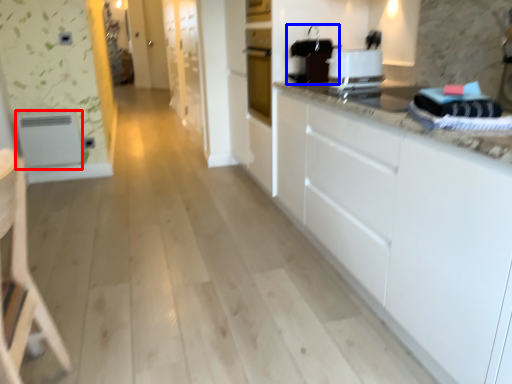
Question: Among these objects, which one is farthest to the camera, appliance (highlighted by a red box) or appliance (highlighted by a blue box)?

Choices:
 (A) appliance
 (B) appliance

Answer: (A)